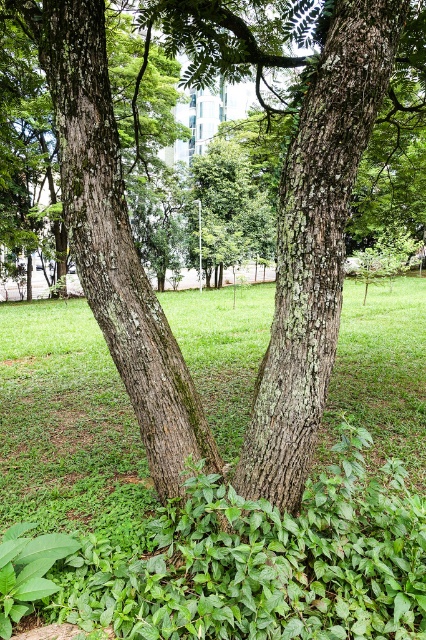
Question: Which point appears farthest from the camera in this image?

Choices:
 (A) (238, 600)
 (B) (340, 134)

Answer: (B)

Question: Which of the following is the closest to the observer?

Choices:
 (A) (310, 608)
 (B) (353, 118)

Answer: (B)

Question: Is green leafy grass at center to the left of green rough bark tree trunk at left from the viewer's perspective?

Choices:
 (A) no
 (B) yes

Answer: (B)

Question: Observing the image, what is the correct spatial positioning of green leafy grass at center in reference to smooth bark tree trunk at center?

Choices:
 (A) above
 (B) below

Answer: (B)

Question: Among these objects, which one is farthest from the camera?

Choices:
 (A) green rough bark tree trunk at left
 (B) smooth bark tree trunk at center
 (C) green leafy grass at center

Answer: (A)

Question: Is green leafy grass at center behind green rough bark tree trunk at left?

Choices:
 (A) no
 (B) yes

Answer: (A)